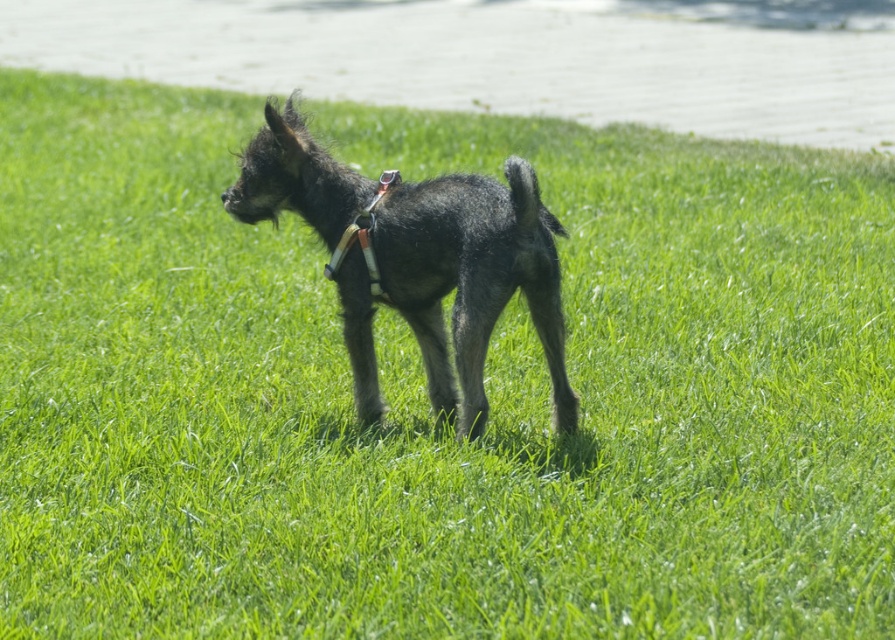
Question: Based on their relative distances, which object is farther from the white leather neckband at center?

Choices:
 (A) shiny black dog at center
 (B) black fuzzy tail at center

Answer: (B)

Question: Which point appears farthest from the camera in this image?

Choices:
 (A) (399, 196)
 (B) (538, 218)
 (C) (347, 244)

Answer: (C)

Question: Is white leather neckband at center above black fuzzy tail at center?

Choices:
 (A) no
 (B) yes

Answer: (A)

Question: Which object appears closest to the camera in this image?

Choices:
 (A) white leather neckband at center
 (B) black fuzzy tail at center
 (C) shiny black dog at center

Answer: (B)

Question: Does shiny black dog at center have a greater width compared to black fuzzy tail at center?

Choices:
 (A) no
 (B) yes

Answer: (B)

Question: Can you confirm if shiny black dog at center is positioned below white leather neckband at center?

Choices:
 (A) no
 (B) yes

Answer: (B)